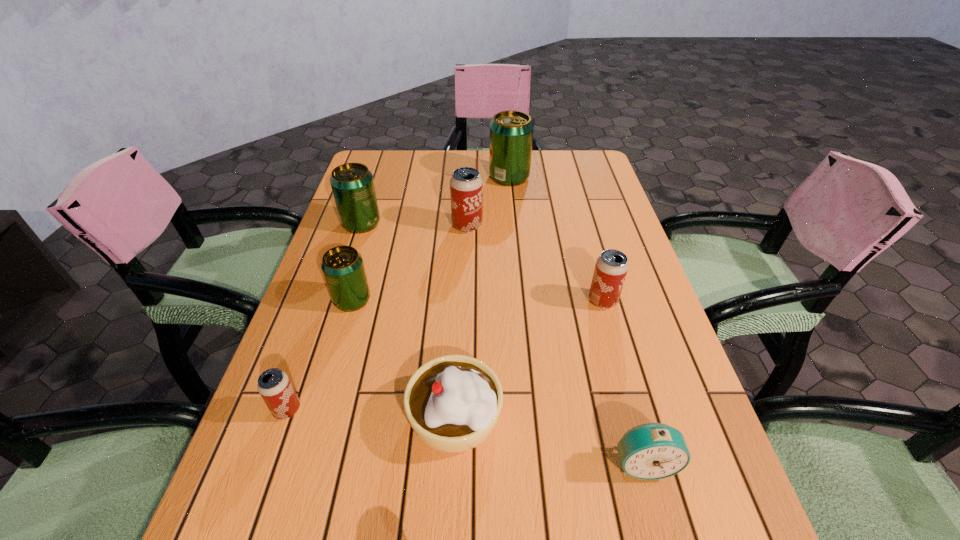
The image size is (960, 540). In order to click on the nearest red beer can in this screenshot , I will do `click(274, 385)`.

At what (x,y) coordinates should I click in order to perform the action: click on the shortest beer can. Please return your answer as a coordinate pair (x, y). This screenshot has width=960, height=540. Looking at the image, I should click on (274, 385).

You are a GUI agent. You are given a task and a screenshot of the screen. Output one action in this format:
    pyautogui.click(x=<x>, y=<y>)
    Task: Click on the vacant point located on the left of the farthest green beer can
    The height and width of the screenshot is (540, 960).
    Given the screenshot: What is the action you would take?
    pyautogui.click(x=367, y=177)

This screenshot has height=540, width=960. What are the coordinates of `free spot located 0.320m on the back of the farthest red beer can` in the screenshot? It's located at (469, 163).

In order to click on free location located on the front of the second smallest green beer can in this screenshot , I will do `click(353, 247)`.

Locate an element on the screen. free spot located on the right of the smallest green beer can is located at coordinates (447, 300).

Locate an element on the screen. Image resolution: width=960 pixels, height=540 pixels. vacant point located on the front of the rightmost beer can is located at coordinates (639, 430).

In order to click on free location located 0.140m on the right of the beige whipped cream in this screenshot , I will do `click(578, 416)`.

Where is `blank space located 0.060m on the front-facing side of the blue alarm clock`? This screenshot has height=540, width=960. blank space located 0.060m on the front-facing side of the blue alarm clock is located at coordinates (660, 522).

Locate an element on the screen. The width and height of the screenshot is (960, 540). vacant space located on the back of the leftmost red beer can is located at coordinates (324, 306).